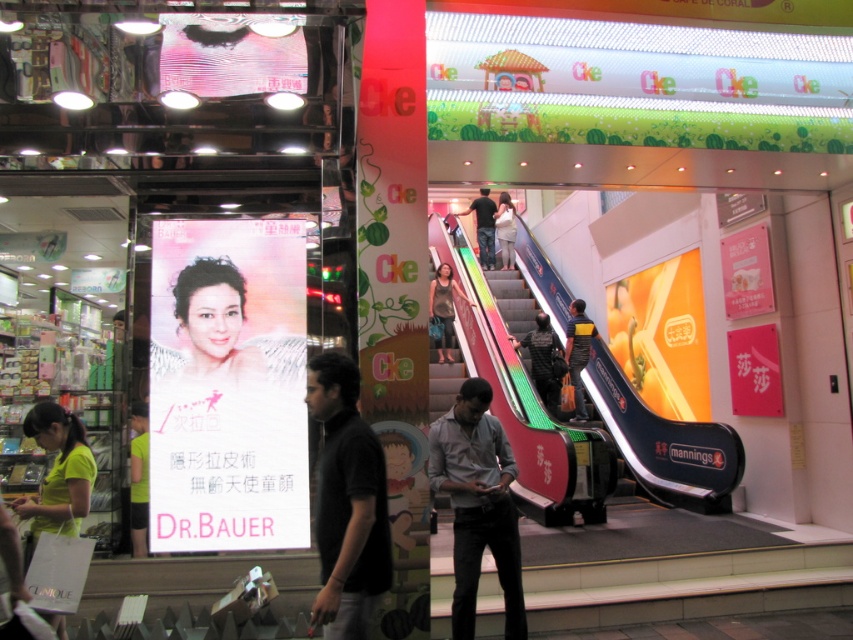
You are a customer in the mall and want to try on the dark gray fabric jacket at center and the white cotton shirt at center. Which one can you reach first without moving your position?

The dark gray fabric jacket at center is closer to the viewer than the white cotton shirt at center, so you can reach it first without moving your position.